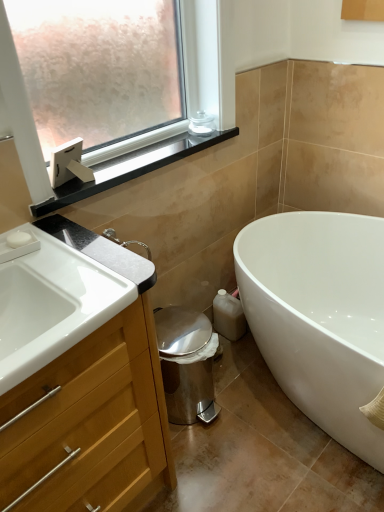
Find the location of a particular element. Image resolution: width=384 pixels, height=512 pixels. vacant area that lies in front of clear glass jar at upper center is located at coordinates (186, 146).